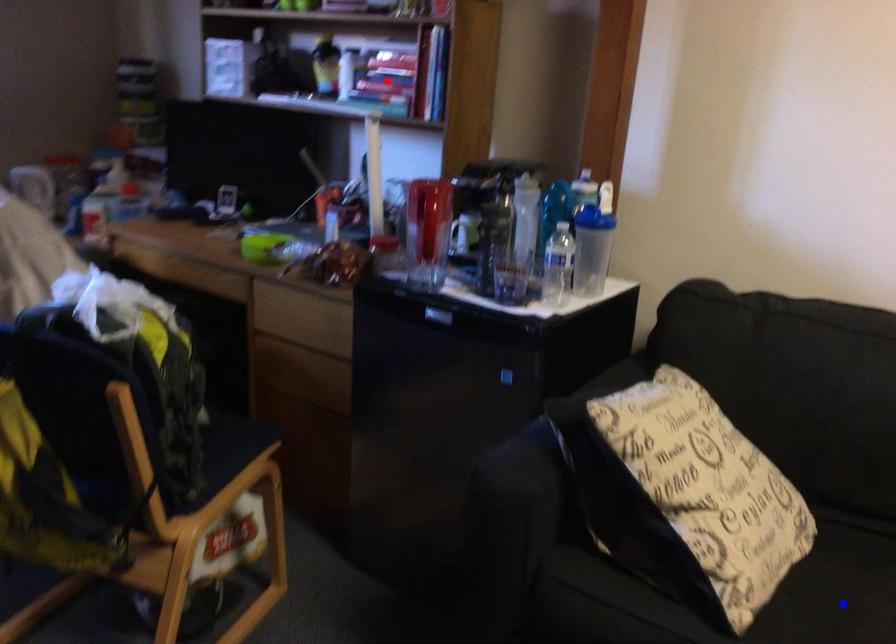
Question: Two points are marked on the image. Which point is closer to the camera?

Choices:
 (A) Blue point is closer.
 (B) Red point is closer.

Answer: (A)